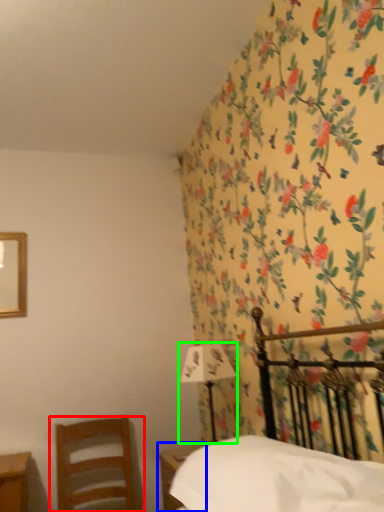
Question: Which is nearer to the chair (highlighted by a red box)? nightstand (highlighted by a blue box) or bedside lamp (highlighted by a green box).

Choices:
 (A) nightstand
 (B) bedside lamp

Answer: (A)